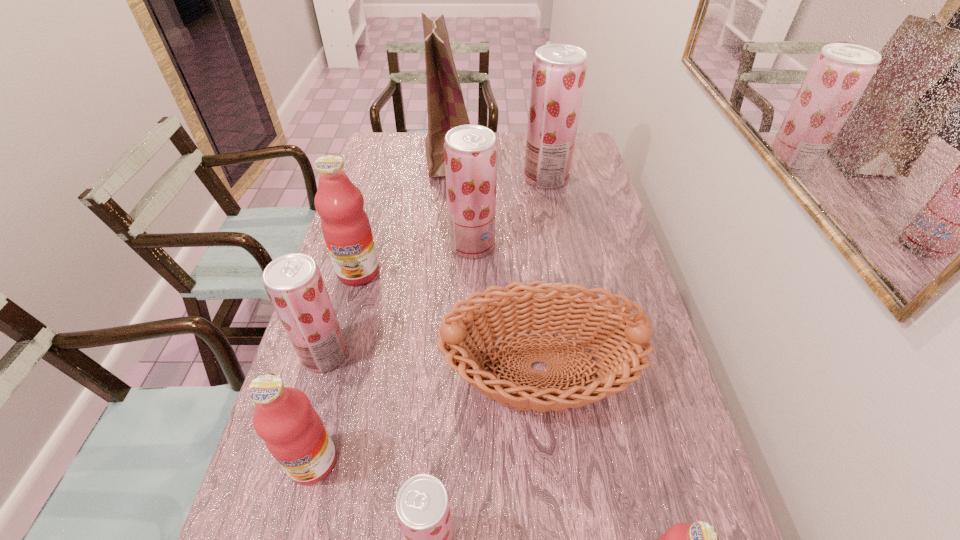
Locate an element on the screen. The image size is (960, 540). strawberry fruit juice that stands as the third closest to the third smallest strawberry fruit juice is located at coordinates (422, 506).

Image resolution: width=960 pixels, height=540 pixels. What are the coordinates of `the third closest pink fruit juice to the fourth farthest fruit juice` in the screenshot? It's located at (700, 539).

Choose which pink fruit juice is the nearest neighbor to the farthest fruit juice. Please provide its 2D coordinates. Your answer should be formatted as a tuple, i.e. [(x, y)], where the tuple contains the x and y coordinates of a point satisfying the conditions above.

[(345, 225)]

Find the location of a particular element. The width and height of the screenshot is (960, 540). blank area in the image that satisfies the following two spatial constraints: 1. on the label of the biggest pink fruit juice; 2. on the right side of the basket is located at coordinates (332, 368).

Identify the location of free spot that satisfies the following two spatial constraints: 1. on the front-facing side of the grocery bag; 2. on the label of the farthest pink fruit juice. (443, 272).

At what (x,y) coordinates should I click in order to perform the action: click on vacant space that satisfies the following two spatial constraints: 1. on the front-facing side of the grocery bag; 2. on the label of the biggest pink fruit juice. Please return your answer as a coordinate pair (x, y). This screenshot has height=540, width=960. Looking at the image, I should click on pos(443,272).

At what (x,y) coordinates should I click in order to perform the action: click on vacant area in the image that satisfies the following two spatial constraints: 1. on the front-facing side of the third nearest strawberry fruit juice; 2. on the right side of the grocery bag. Please return your answer as a coordinate pair (x, y). Looking at the image, I should click on (x=444, y=245).

Identify the location of free region that satisfies the following two spatial constraints: 1. on the front-facing side of the grocery bag; 2. on the label of the second farthest pink fruit juice. (427, 462).